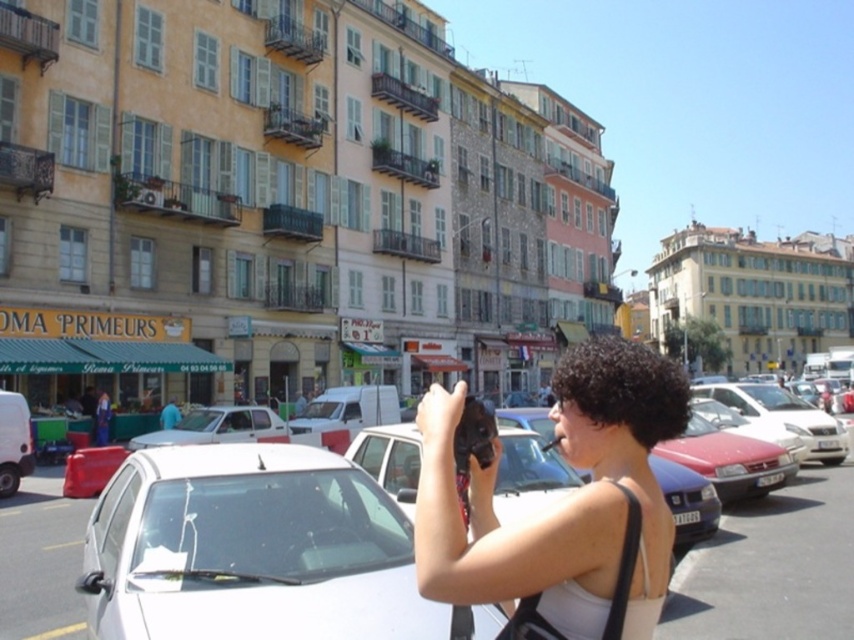
Is matte black camera at center positioned at the back of white glossy car at lower left?

No, matte black camera at center is closer to the viewer.

Does point (606, 608) lie behind point (763, 442)?

No, it is in front of (763, 442).

You are a GUI agent. You are given a task and a screenshot of the screen. Output one action in this format:
    pyautogui.click(x=<x>, y=<y>)
    Task: Click on the matte black camera at center
    Image resolution: width=854 pixels, height=640 pixels.
    Given the screenshot: What is the action you would take?
    pyautogui.click(x=560, y=497)

Who is taller, white glossy car at center or white matte car at lower left?

With more height is white matte car at lower left.

What do you see at coordinates (255, 552) in the screenshot? This screenshot has height=640, width=854. I see `white glossy car at center` at bounding box center [255, 552].

Between point (376, 522) and point (268, 440), which one is positioned in front?

Point (376, 522)

Where is `white glossy car at center`? white glossy car at center is located at coordinates (255, 552).

Does white glossy car at center have a smaller size compared to matte black camera at center?

Indeed, white glossy car at center has a smaller size compared to matte black camera at center.

Does point (266, 544) lie behind point (437, 390)?

Yes, it is behind point (437, 390).

Identify the location of white glossy car at center. The width and height of the screenshot is (854, 640). (255, 552).